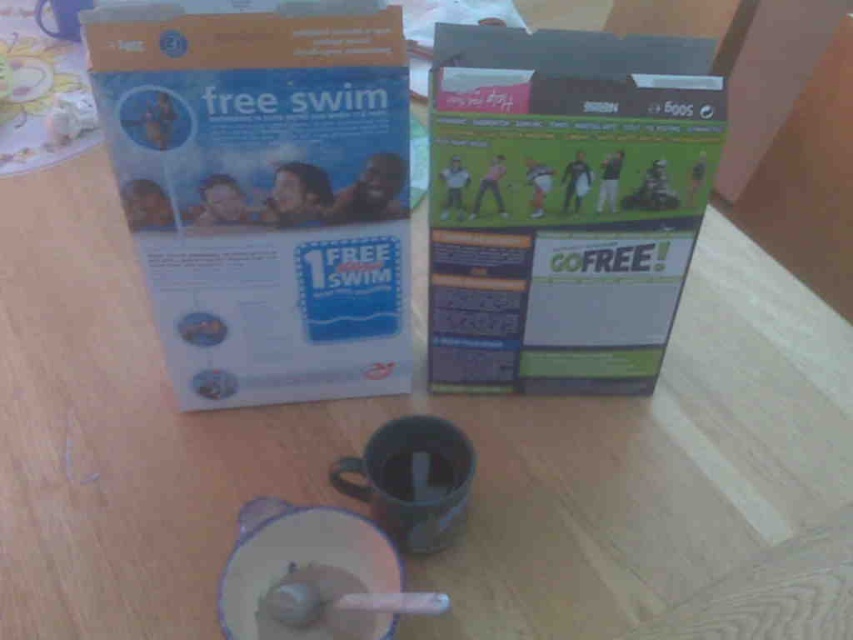
Question: Is matte white cardboard box at upper left to the right of matte green cardboard box at center from the viewer's perspective?

Choices:
 (A) yes
 (B) no

Answer: (B)

Question: Which of the following is the closest to the observer?

Choices:
 (A) (544, 70)
 (B) (258, 266)

Answer: (A)

Question: Can you confirm if matte white cardboard box at upper left is positioned to the left of matte green cardboard box at center?

Choices:
 (A) yes
 (B) no

Answer: (A)

Question: Is matte white cardboard box at upper left bigger than matte green cardboard box at center?

Choices:
 (A) yes
 (B) no

Answer: (A)

Question: Among these objects, which one is farthest from the camera?

Choices:
 (A) matte green cardboard box at center
 (B) matte white cardboard box at upper left

Answer: (A)

Question: Which point appears farthest from the camera in this image?

Choices:
 (A) (143, 140)
 (B) (531, 164)

Answer: (B)